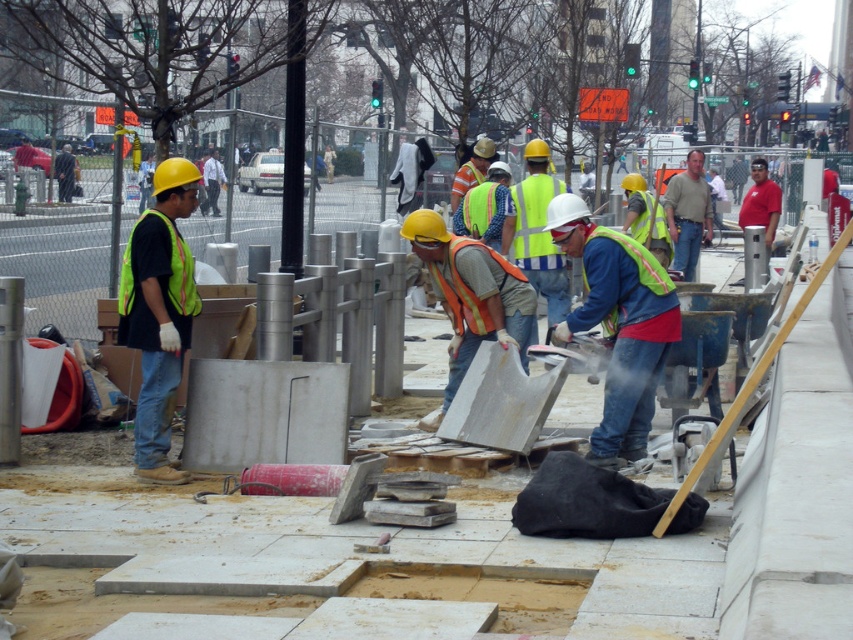
Looking at this image, is matte yellow hard hat at left to the left of reflective yellow safety vest at center from the viewer's perspective?

No, matte yellow hard hat at left is not to the left of reflective yellow safety vest at center.

How far apart are matte yellow hard hat at left and reflective yellow safety vest at center?

A distance of 6.72 meters exists between matte yellow hard hat at left and reflective yellow safety vest at center.

Who is more forward, (190, 192) or (212, 150)?

Point (190, 192)

Locate an element on the screen. matte yellow hard hat at left is located at coordinates (160, 312).

Does point (427, 424) come farther from viewer compared to point (173, 243)?

Yes.

Who is lower down, orange reflective vest at center or high visibility yellow-green safety vest at left?

Positioned lower is orange reflective vest at center.

Does point (424, 422) come in front of point (170, 227)?

No.

This screenshot has height=640, width=853. I want to click on orange reflective vest at center, so click(469, 296).

Looking at this image, does white matte hard hat at center have a lesser height compared to orange reflective vest at center?

In fact, white matte hard hat at center may be taller than orange reflective vest at center.

Who is lower down, white matte hard hat at center or orange reflective vest at center?

orange reflective vest at center is lower down.

Between point (631, 266) and point (485, 253), which one is positioned in front?

Point (631, 266)

Where is `white matte hard hat at center`? Image resolution: width=853 pixels, height=640 pixels. white matte hard hat at center is located at coordinates pyautogui.click(x=618, y=326).